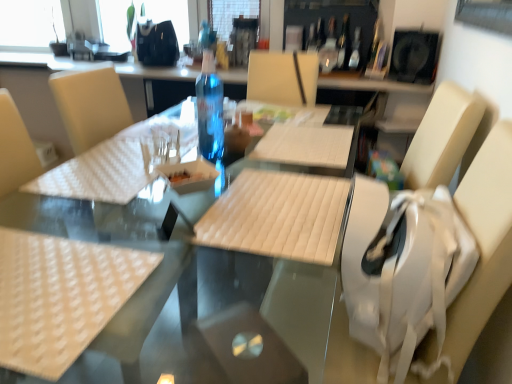
Question: Is white quilted fabric at center positioned behind transparent plastic bottle at center, the first bottle in the left-to-right sequence?

Choices:
 (A) yes
 (B) no

Answer: (B)

Question: Can we say white quilted fabric at center lies outside transparent plastic bottle at center, which appears as the third bottle when viewed from the back?

Choices:
 (A) yes
 (B) no

Answer: (A)

Question: Does white quilted fabric at center turn towards transparent plastic bottle at center, marked as the 3th bottle in a right-to-left arrangement?

Choices:
 (A) yes
 (B) no

Answer: (B)

Question: Is white quilted fabric at center positioned with its back to transparent plastic bottle at center, positioned as the first bottle in bottom-to-top order?

Choices:
 (A) yes
 (B) no

Answer: (B)

Question: From a real-world perspective, is white quilted fabric at center under transparent plastic bottle at center, which is the third bottle from top to bottom?

Choices:
 (A) no
 (B) yes

Answer: (B)

Question: Is white quilted fabric at center at the right side of transparent plastic bottle at center, the first bottle in the left-to-right sequence?

Choices:
 (A) no
 (B) yes

Answer: (B)

Question: Are transparent plastic bottle at center, positioned as the 2th bottle in left-to-right order, and white quilted fabric at center making contact?

Choices:
 (A) yes
 (B) no

Answer: (B)

Question: Is transparent plastic bottle at center, positioned as the 2th bottle in left-to-right order, at the right side of white quilted fabric at center?

Choices:
 (A) no
 (B) yes

Answer: (B)

Question: Does transparent plastic bottle at center, placed as the third bottle when sorted from front to back, have a greater width compared to white quilted fabric at center?

Choices:
 (A) no
 (B) yes

Answer: (A)

Question: Is transparent plastic bottle at center, the second bottle positioned from the right, outside of white quilted fabric at center?

Choices:
 (A) no
 (B) yes

Answer: (B)

Question: Considering the relative sizes of transparent plastic bottle at center, positioned as the 2th bottle in left-to-right order, and white quilted fabric at center in the image provided, is transparent plastic bottle at center, positioned as the 2th bottle in left-to-right order, thinner than white quilted fabric at center?

Choices:
 (A) yes
 (B) no

Answer: (A)

Question: Is white quilted fabric at center surrounded by transparent plastic bottle at center, marked as the third bottle in a bottom-to-top arrangement?

Choices:
 (A) yes
 (B) no

Answer: (B)

Question: From a real-world perspective, is transparent plastic bottle at center, marked as the third bottle in a bottom-to-top arrangement, physically above white fabric swivel chair at right?

Choices:
 (A) no
 (B) yes

Answer: (B)